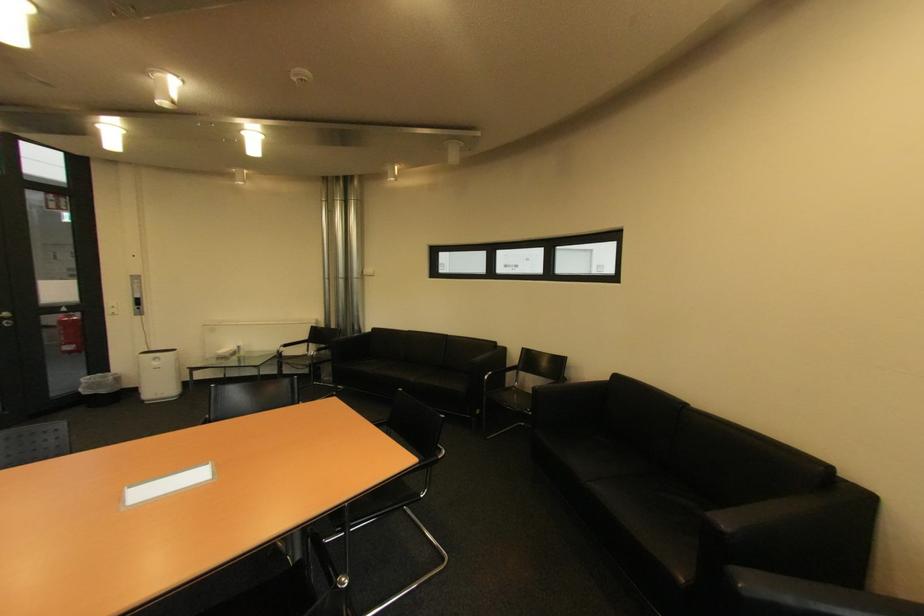
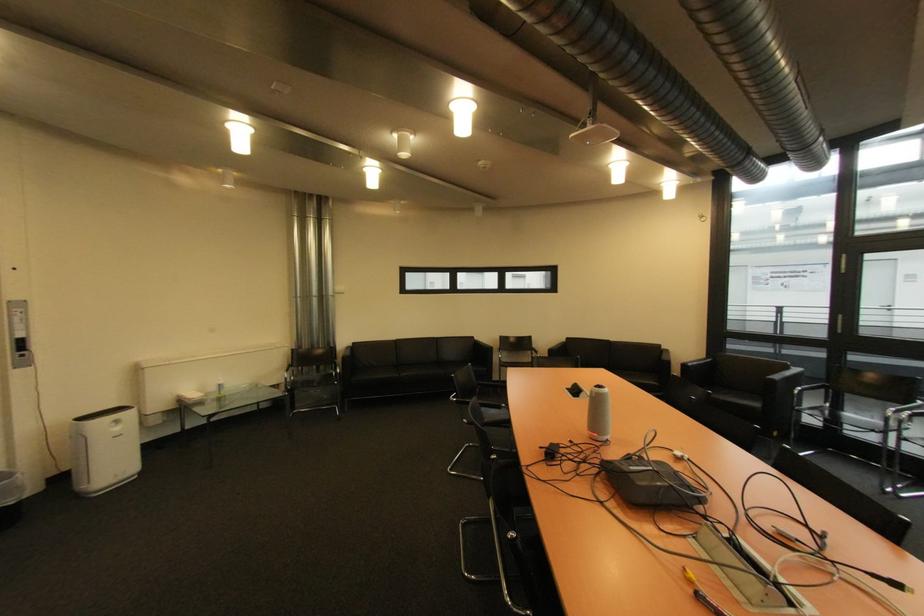
Find the pixel in the second image that matches (321,329) in the first image.

(301, 352)